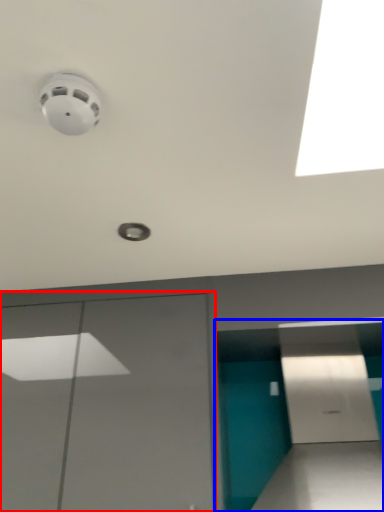
Question: Among these objects, which one is farthest to the camera, garage door (highlighted by a red box) or parking garage (highlighted by a blue box)?

Choices:
 (A) garage door
 (B) parking garage

Answer: (A)